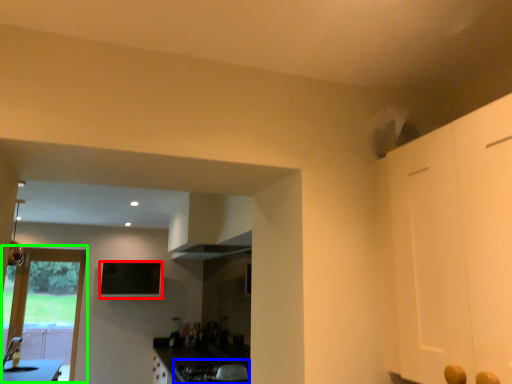
Question: Which object is positioned farthest from window screen (highlighted by a red box)? Select from gas stove (highlighted by a blue box) and door (highlighted by a green box).

Choices:
 (A) gas stove
 (B) door

Answer: (A)